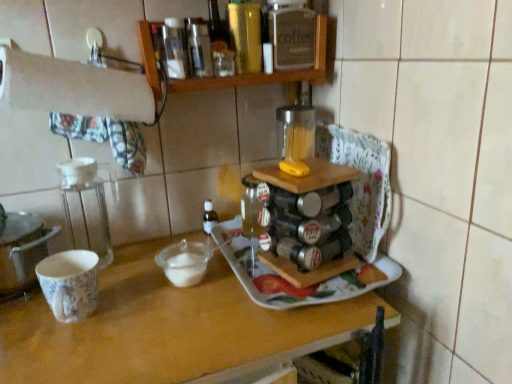
Where is `vacant area that lies in front of transparent plastic container at left`? vacant area that lies in front of transparent plastic container at left is located at coordinates (81, 314).